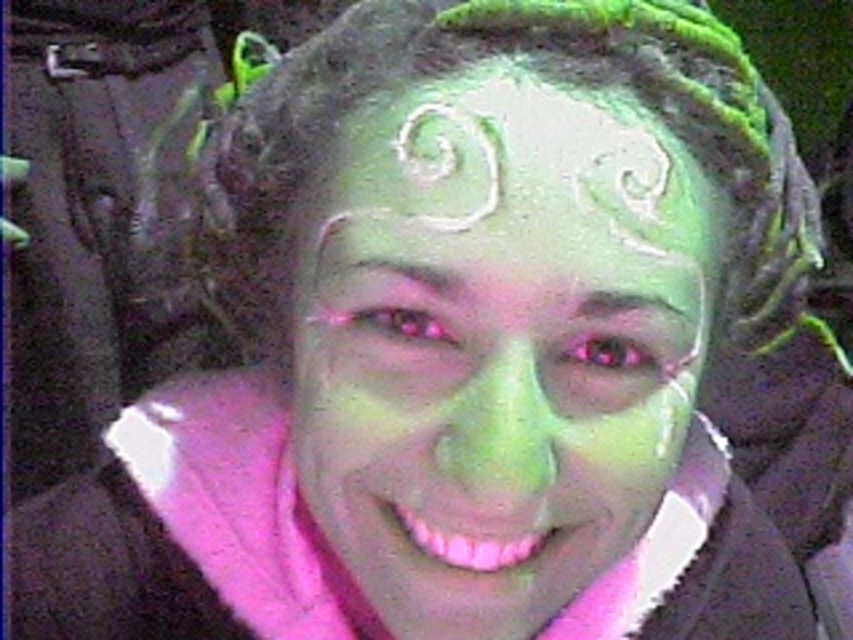
You are an artist preparing to paint a face similar to the one in the image. You have both the green matte face paint at center and the white matte forehead at center. Which should you apply first to ensure the design appears correctly?

The green matte face paint at center should be applied first because it is in front of the white matte forehead at center, so placing it over the white area will create the correct layered look.

You are a photographer who wants to capture the vibrant green face paint of the person in the image. Given that the point at coordinates (503, 355) marks the center of the green matte face paint, where should you focus your camera to ensure the face paint is in sharp focus?

You should focus your camera on the point at coordinates (503, 355), which marks the center of the green matte face paint at center, to ensure the face paint is in sharp focus.

You are an artist trying to replicate the face painting design seen in the image. The design is centered on the face. If you were to place a sticker exactly at the center of the face, where would the green matte face paint at center be in relation to that sticker?

The green matte face paint at center is located at point coordinates approximately 0.556 on the x and 0.592 on the y axis, which is slightly above and to the right of the exact center point of the face.